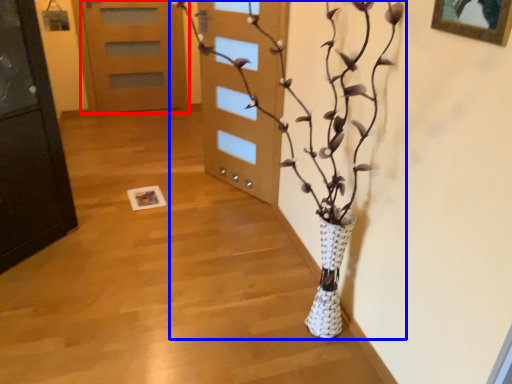
Question: Which point is further to the camera, door (highlighted by a red box) or houseplant (highlighted by a blue box)?

Choices:
 (A) door
 (B) houseplant

Answer: (A)